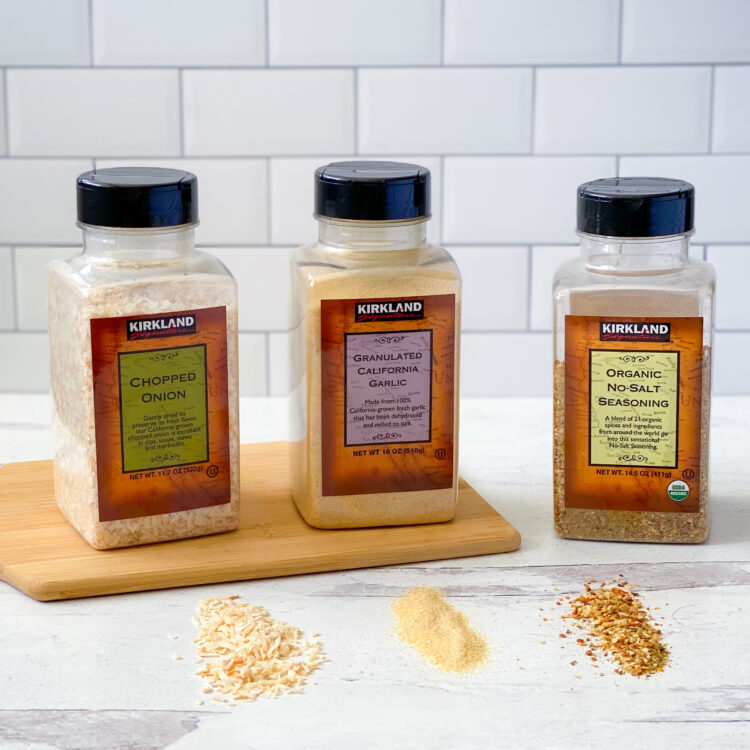
The image size is (750, 750). Identify the location of plastic spice bottle. (141, 265), (374, 272), (655, 286).